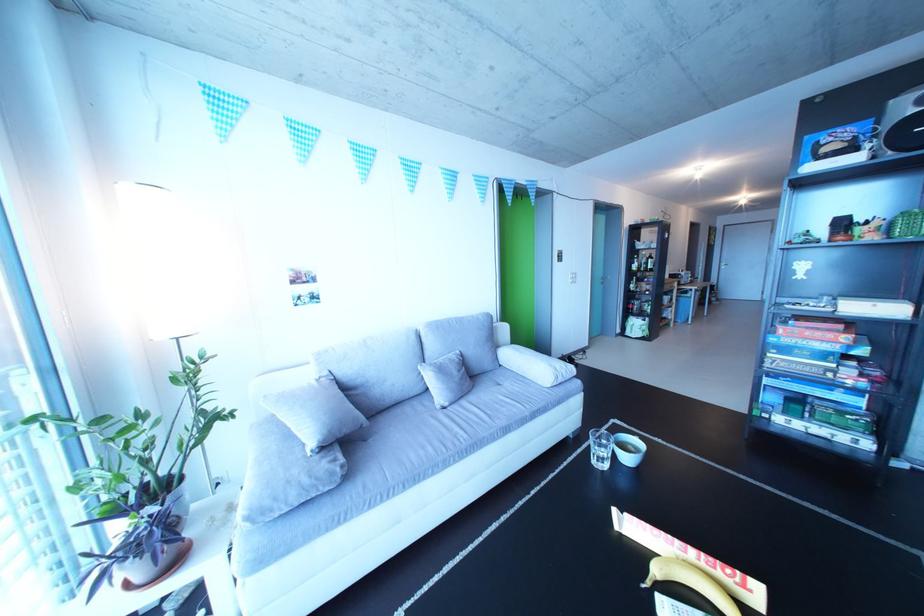
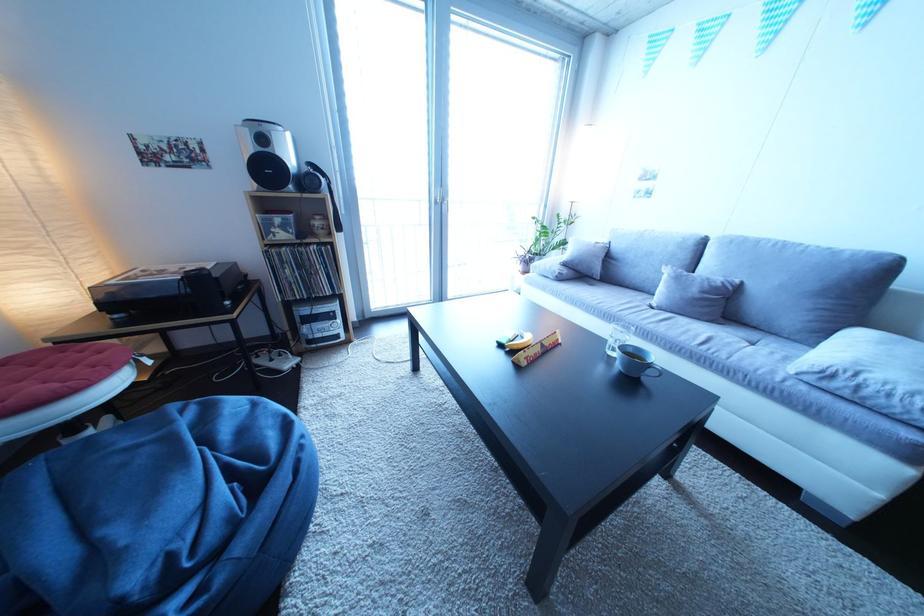
In the second image, find the point that corresponds to (346,480) in the first image.

(567, 278)